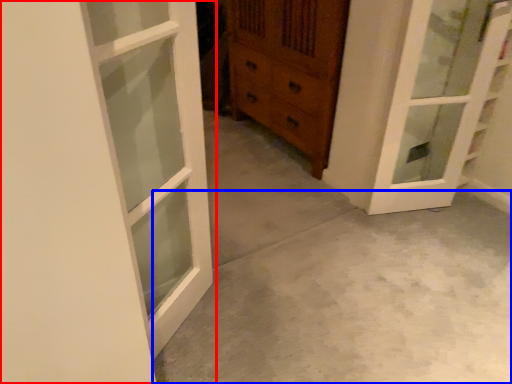
Question: Among these objects, which one is farthest to the camera, door (highlighted by a red box) or concrete (highlighted by a blue box)?

Choices:
 (A) door
 (B) concrete

Answer: (B)